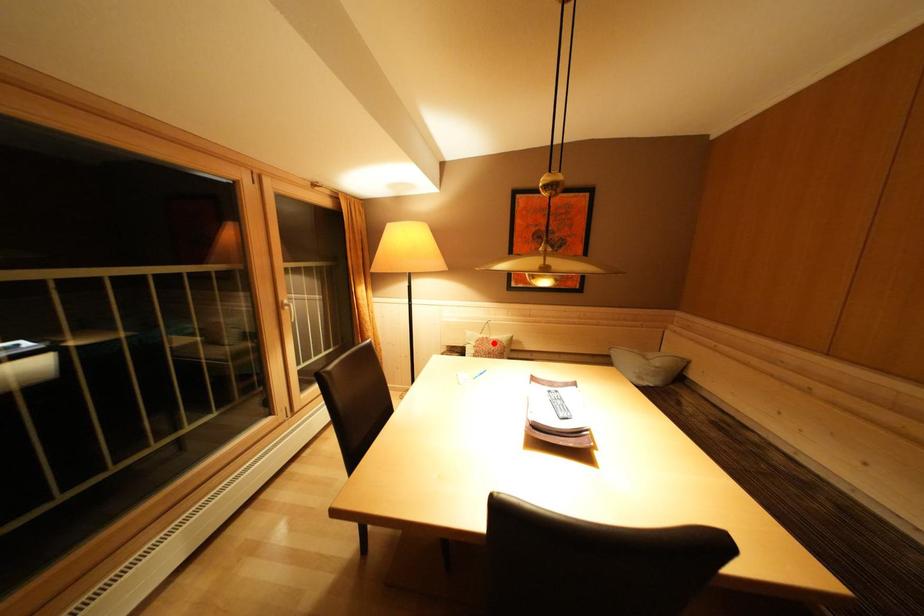
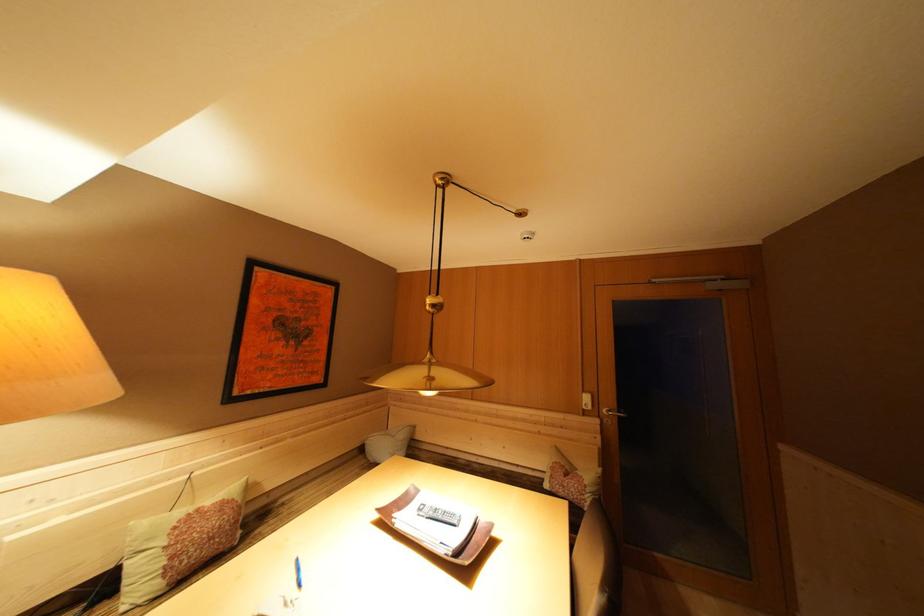
Question: I am providing you with two images of the same scene from different viewpoints. A red point is marked on the first image. Can you still see the location of the red point in image 2?

Choices:
 (A) Yes
 (B) No

Answer: (A)